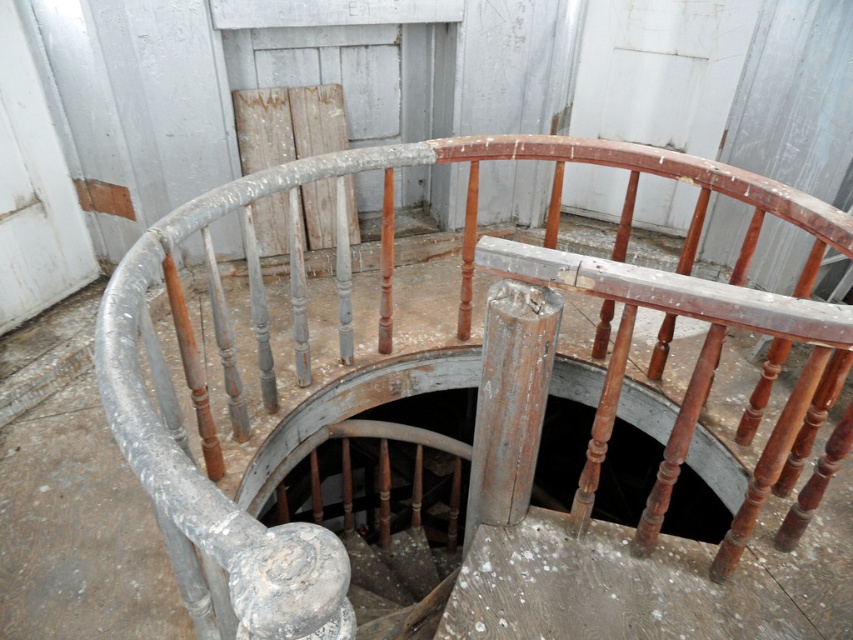
Question: Is rusty wood railing at center positioned behind dark wood hole at center?

Choices:
 (A) yes
 (B) no

Answer: (B)

Question: Among these objects, which one is farthest from the camera?

Choices:
 (A) dark wood hole at center
 (B) rusty wood railing at center

Answer: (A)

Question: Does rusty wood railing at center appear on the right side of dark wood hole at center?

Choices:
 (A) no
 (B) yes

Answer: (A)

Question: Is the position of rusty wood railing at center less distant than that of dark wood hole at center?

Choices:
 (A) no
 (B) yes

Answer: (B)